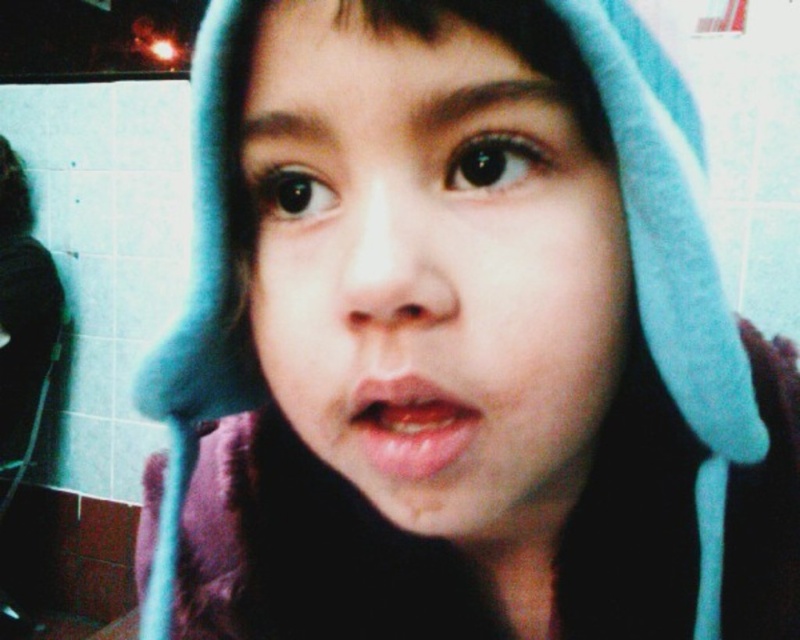
Where is the smooth skin face at center located in the image?

The smooth skin face at center is located at point coordinates of [430,266].

You are taking a photo in the bathroom and notice two points in the frame. One is at point (296, 113) and the other at point (444, 426). Which point is closer to the camera?

Point (296, 113) is further to the camera than point (444, 426), so the point closer to the camera is point (444, 426).

You are standing in a bathroom and see a point marked at coordinates (532, 529). If you want to place a 40 cm wide decorative plate on the wall at this point, will it fit without overlapping other objects?

The point at (532, 529) is 39.87 centimeters away from you. Since the plate is 40 cm wide, it might just barely fit, but there is a slight risk of overlapping nearby objects depending on the exact placement.